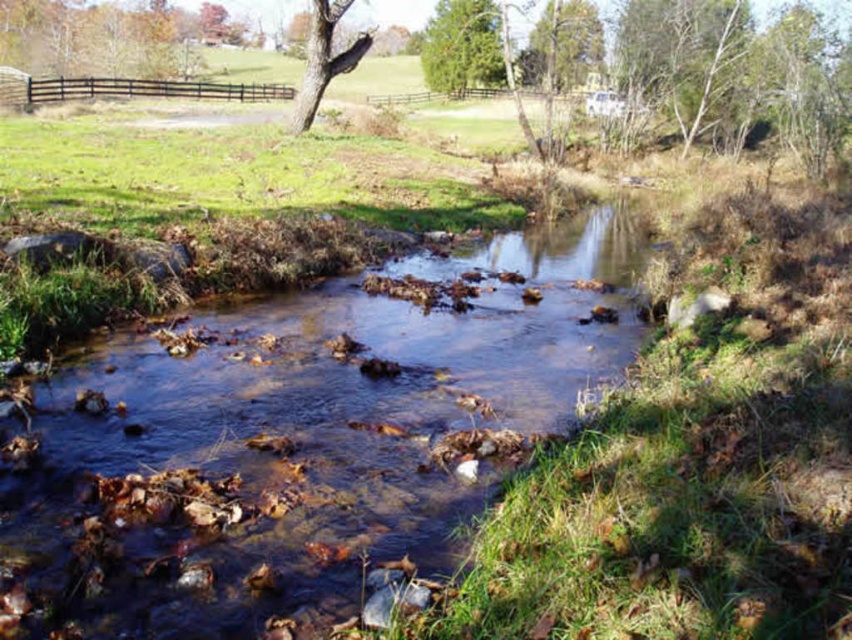
Who is positioned more to the right, translucent brown water at center or green textured tree at upper center?

green textured tree at upper center is more to the right.

Is translucent brown water at center to the left of green textured tree at upper center from the viewer's perspective?

Indeed, translucent brown water at center is positioned on the left side of green textured tree at upper center.

Who is more distant from viewer, (619, 269) or (444, 3)?

The point (444, 3) is behind.

What are the coordinates of `translucent brown water at center` in the screenshot? It's located at (297, 438).

Can you confirm if translucent brown water at center is bigger than smooth bark tree at upper center?

Incorrect, translucent brown water at center is not larger than smooth bark tree at upper center.

The height and width of the screenshot is (640, 852). What do you see at coordinates (297, 438) in the screenshot? I see `translucent brown water at center` at bounding box center [297, 438].

Locate an element on the screen. The width and height of the screenshot is (852, 640). translucent brown water at center is located at coordinates (297, 438).

Which is above, green textured tree at upper center or smooth bark tree at upper center?

green textured tree at upper center

What are the coordinates of `green textured tree at upper center` in the screenshot? It's located at (462, 45).

At what (x,y) coordinates should I click in order to perform the action: click on green textured tree at upper center. Please return your answer as a coordinate pair (x, y). This screenshot has width=852, height=640. Looking at the image, I should click on (462, 45).